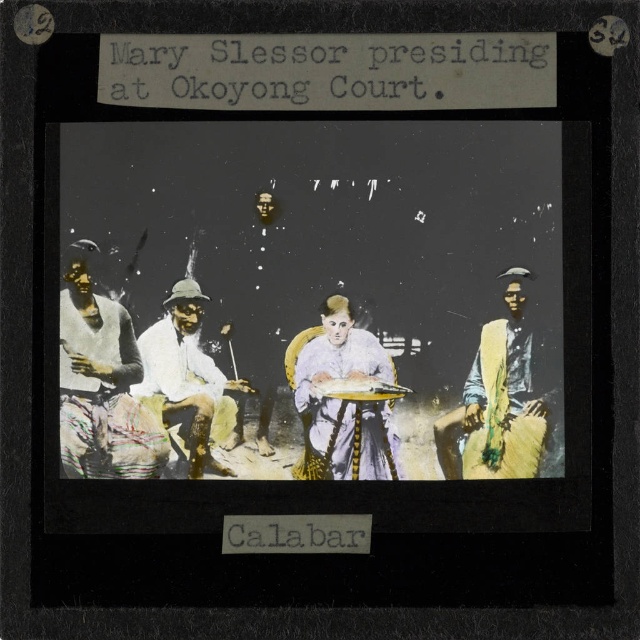
You are an anthropologist examining this historical photograph. You notice two central items of clothing or accessories. Which item has a narrower width between the white silk dress at center and the white cloth hat at center?

The white silk dress at center has a lesser width compared to the white cloth hat at center, so the white silk dress at center is narrower in width.

You are an anthropologist examining this historical photograph of Mary Slessor presiding at Okoyong Court in Calabar. You notice two items in the image that are both white in color. The first is a white textured fabric at left, and the second is a white cloth hat at center. Based on the spatial arrangement in the photograph, which of these two items appears narrower in width?

The white textured fabric at left has a lesser width compared to the white cloth hat at center, so the white textured fabric at left appears narrower in width.

You are a photographer who wants to take a closeup shot of the white silk dress at center and the yellow fabric at right in the historical photo. Can you fit both objects into your camera frame which has a maximum width of 6 inches?

The white silk dress at center is 5.46 inches away from the yellow fabric at right. Since the distance between them is less than the camera frame width of 6 inches, both objects can fit into the frame.